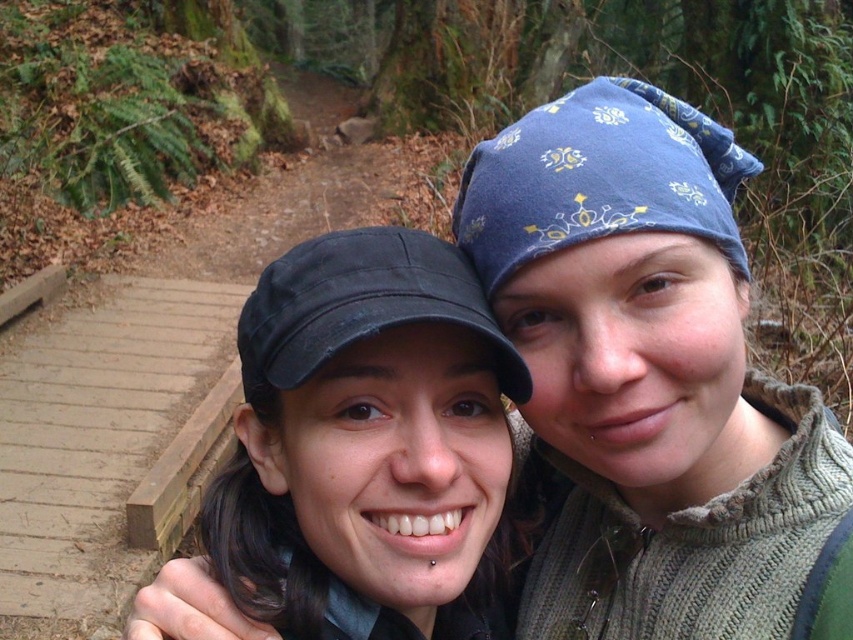
Is blue printed fabric bandana at upper right smaller than black fabric cap at center?

No.

Consider the image. Does blue printed fabric bandana at upper right appear over black fabric cap at center?

Correct, blue printed fabric bandana at upper right is located above black fabric cap at center.

Is point (505, 273) positioned before point (262, 376)?

No, it is behind (262, 376).

Locate an element on the screen. Image resolution: width=853 pixels, height=640 pixels. blue printed fabric bandana at upper right is located at coordinates (598, 177).

Can you confirm if blue printed bandana at upper right is positioned above blue printed fabric bandana at upper right?

Incorrect, blue printed bandana at upper right is not positioned above blue printed fabric bandana at upper right.

Measure the distance from blue printed bandana at upper right to blue printed fabric bandana at upper right.

blue printed bandana at upper right and blue printed fabric bandana at upper right are 12.29 centimeters apart.

Is point (634, 348) more distant than point (596, 122)?

No.

Image resolution: width=853 pixels, height=640 pixels. Identify the location of blue printed bandana at upper right. coord(646,374).

Who is more forward, [598,371] or [305,346]?

Point [305,346]

Is the position of blue printed bandana at upper right less distant than that of matte black cap at center?

No, it is not.

Describe the element at coordinates (646, 374) in the screenshot. The height and width of the screenshot is (640, 853). I see `blue printed bandana at upper right` at that location.

Locate an element on the screen. blue printed bandana at upper right is located at coordinates (646, 374).